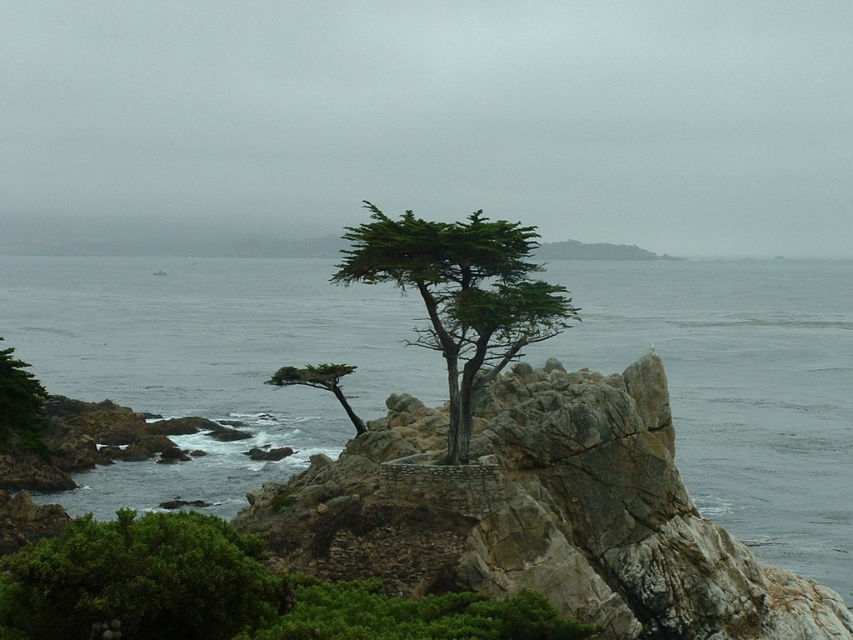
Question: Which object is the farthest from the green leafy cypress at center?

Choices:
 (A) green matte tree at center
 (B) gray water at center
 (C) green textured tree at lower left

Answer: (B)

Question: Is green leafy cypress at center to the right of green matte tree at center from the viewer's perspective?

Choices:
 (A) yes
 (B) no

Answer: (A)

Question: Considering the real-world distances, which object is farthest from the gray water at center?

Choices:
 (A) green leafy shrub at lower left
 (B) green textured tree at lower left

Answer: (B)

Question: Is gray water at center to the left of green matte tree at center from the viewer's perspective?

Choices:
 (A) no
 (B) yes

Answer: (B)

Question: Which object appears farthest from the camera in this image?

Choices:
 (A) green leafy cypress at center
 (B) green textured tree at lower left
 (C) green leafy shrub at lower left
 (D) gray water at center

Answer: (B)

Question: Is gray water at center to the right of green matte tree at center from the viewer's perspective?

Choices:
 (A) no
 (B) yes

Answer: (A)